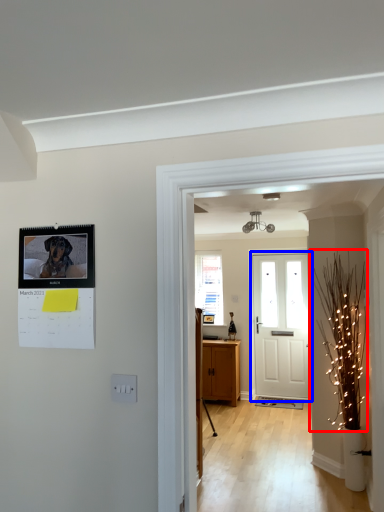
Question: Which of the following is the closest to the observer, christmas light (highlighted by a red box) or door (highlighted by a blue box)?

Choices:
 (A) christmas light
 (B) door

Answer: (A)